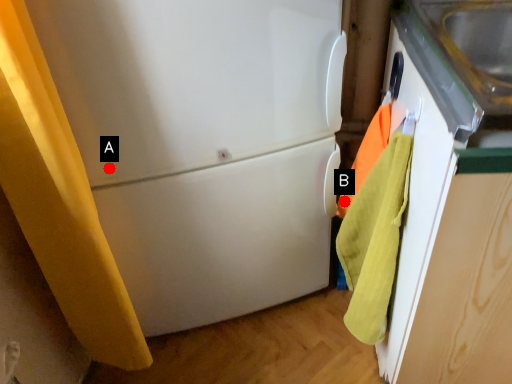
Question: Two points are circled on the image, labeled by A and B beside each circle. Which of the following is the closest to the observer?

Choices:
 (A) A is closer
 (B) B is closer

Answer: (A)